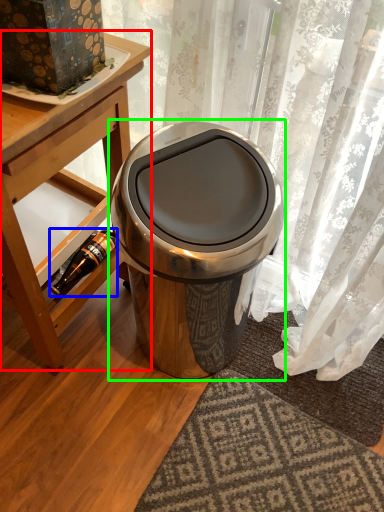
Question: Estimate the real-world distances between objects in this image. Which object is closer to table (highlighted by a red box), bottle (highlighted by a blue box) or waste container (highlighted by a green box)?

Choices:
 (A) bottle
 (B) waste container

Answer: (A)